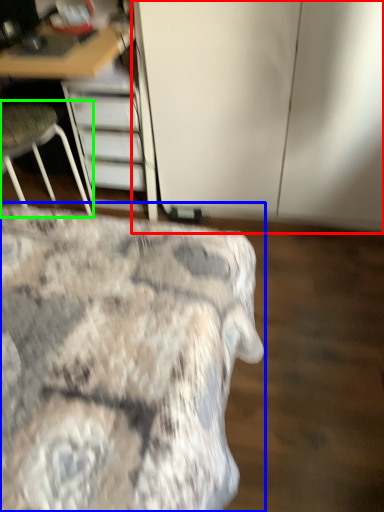
Question: Which is farther away from cabinetry (highlighted by a red box)? bed (highlighted by a blue box) or chair (highlighted by a green box)?

Choices:
 (A) bed
 (B) chair

Answer: (A)